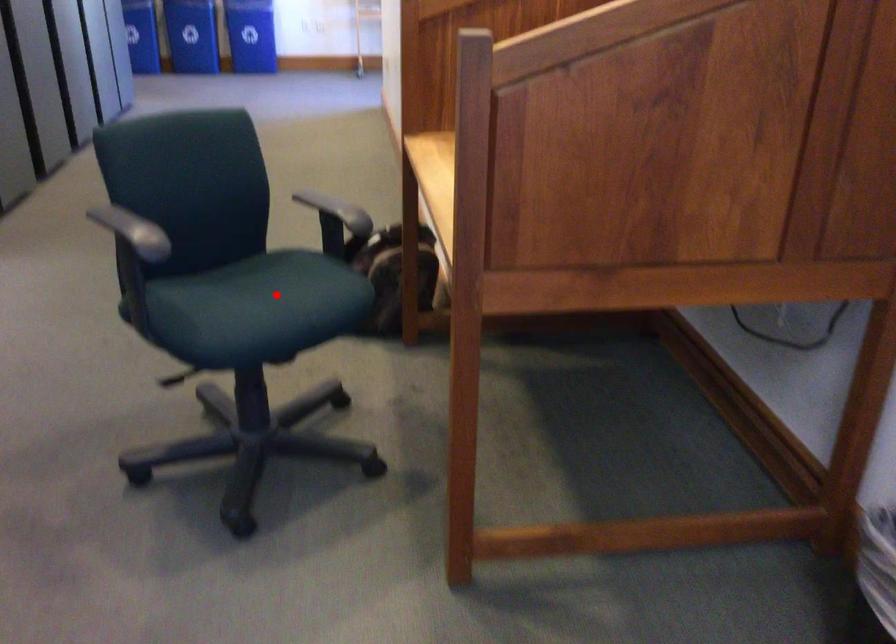
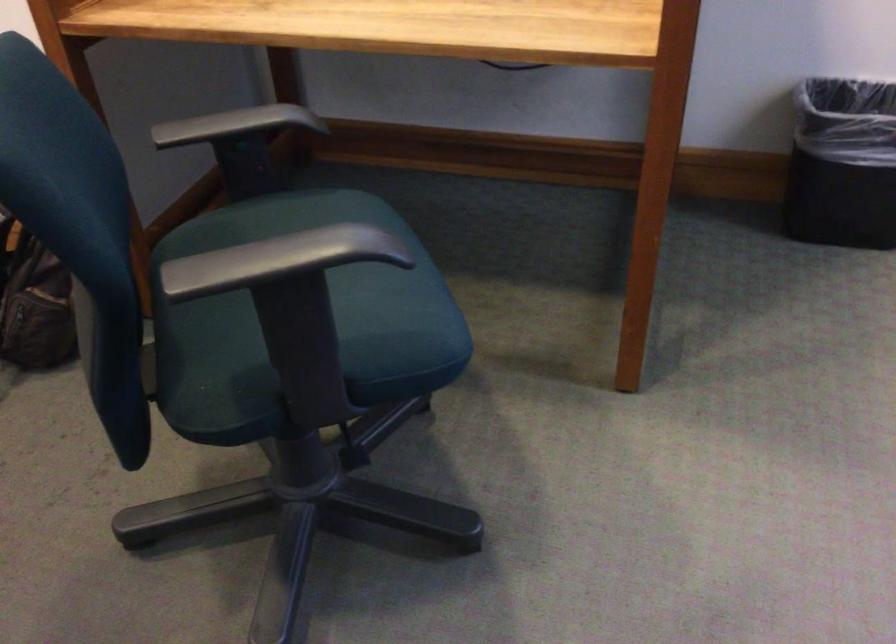
Question: I am providing you with two images of the same scene from different viewpoints. A red point is marked on the first image. Is the red point's position out of view in image 2?

Choices:
 (A) Yes
 (B) No

Answer: (A)